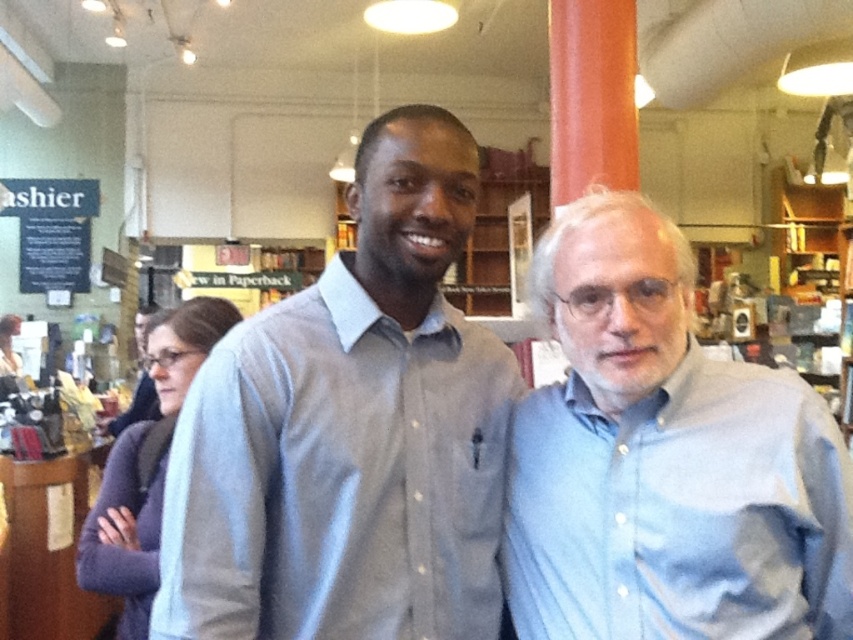
You are standing in the bookstore and want to move from the point marked by coordinates point (648, 428) to the point marked by coordinates point (113, 480). Based on the spatial relationship between these two points, which direction should you move relative to the bookstore layout?

You should move towards the lower right direction because point (648, 428) is in front of point (113, 480), indicating that to reach the latter, you need to move downward and to the right within the bookstore layout.